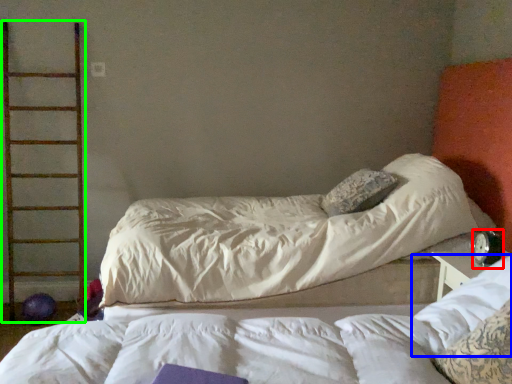
Question: Which object is positioned farthest from alarm clock (highlighted by a red box)? Select from pillow (highlighted by a blue box) and ladder (highlighted by a green box).

Choices:
 (A) pillow
 (B) ladder

Answer: (B)